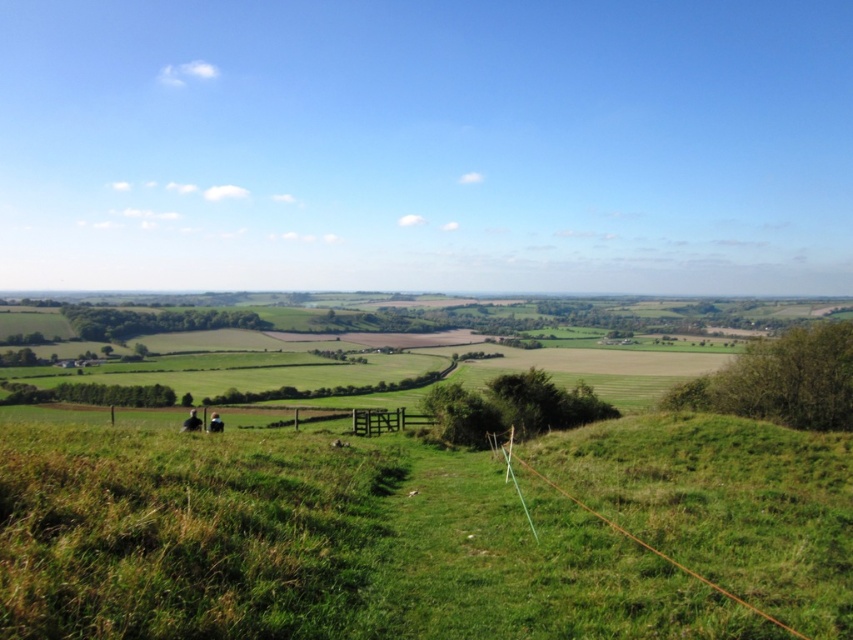
Between green grassy hill at lower left and green wooden fence at center, which one has less height?

With less height is green grassy hill at lower left.

Where is `green grassy hill at lower left`? The width and height of the screenshot is (853, 640). green grassy hill at lower left is located at coordinates (314, 545).

The height and width of the screenshot is (640, 853). Describe the element at coordinates (314, 545) in the screenshot. I see `green grassy hill at lower left` at that location.

Where is `green grassy hill at lower left`? Image resolution: width=853 pixels, height=640 pixels. green grassy hill at lower left is located at coordinates (314, 545).